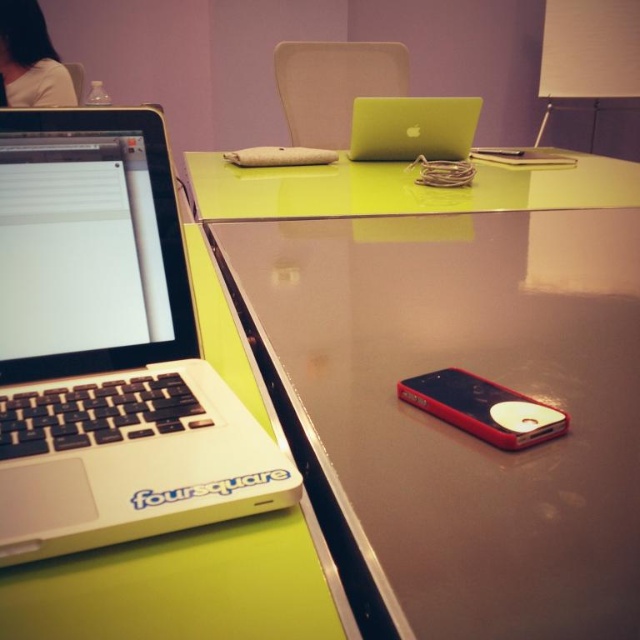
Question: Which object is the farthest from the white matte laptop at left?

Choices:
 (A) green glossy table at center
 (B) glossy plastic table at center
 (C) red plastic phone at lower right

Answer: (A)

Question: Does white matte laptop at left appear on the left side of red plastic phone at lower right?

Choices:
 (A) yes
 (B) no

Answer: (A)

Question: Observing the image, what is the correct spatial positioning of glossy plastic table at center in reference to green glossy table at center?

Choices:
 (A) left
 (B) right

Answer: (A)

Question: Among these objects, which one is nearest to the camera?

Choices:
 (A) metallic green laptop at center
 (B) white matte laptop at left

Answer: (B)

Question: Among these points, which one is farthest from the camera?

Choices:
 (A) (429, 160)
 (B) (221, 516)

Answer: (A)

Question: Is white matte laptop at left positioned behind metallic green laptop at center?

Choices:
 (A) yes
 (B) no

Answer: (B)